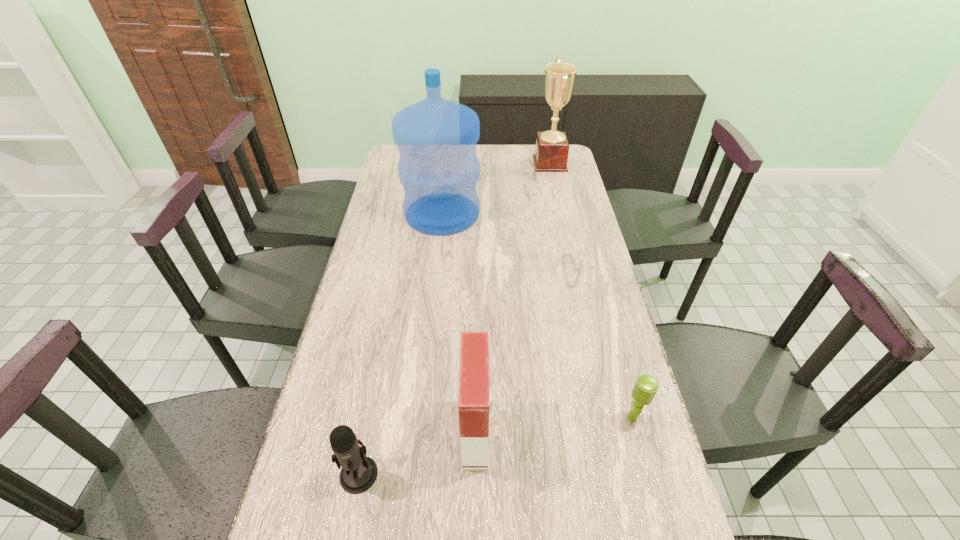
Where is `vacant area that lies between the farther microphone and the fourth shortest object`? vacant area that lies between the farther microphone and the fourth shortest object is located at coordinates (591, 291).

The image size is (960, 540). I want to click on free space between the trophy cup and the left microphone, so click(x=454, y=319).

Find the location of a particular element. Image resolution: width=960 pixels, height=540 pixels. free spot between the third tallest object and the taller microphone is located at coordinates (417, 453).

The width and height of the screenshot is (960, 540). I want to click on empty location between the shortest object and the fourth nearest object, so click(538, 316).

This screenshot has height=540, width=960. Find the location of `object that stands as the fourth closest to the farther microphone`. object that stands as the fourth closest to the farther microphone is located at coordinates (552, 148).

The width and height of the screenshot is (960, 540). Identify the location of object that is the fourth closest one to the shorter microphone. (552, 148).

Where is `vacant area that satisfies the following two spatial constraints: 1. on the back side of the nearer microphone; 2. on the left side of the second farthest object`? vacant area that satisfies the following two spatial constraints: 1. on the back side of the nearer microphone; 2. on the left side of the second farthest object is located at coordinates (410, 213).

The width and height of the screenshot is (960, 540). What are the coordinates of `free space that satisfies the following two spatial constraints: 1. on the back side of the shorter microphone; 2. on the plaque of the trophy cup` in the screenshot? It's located at (564, 164).